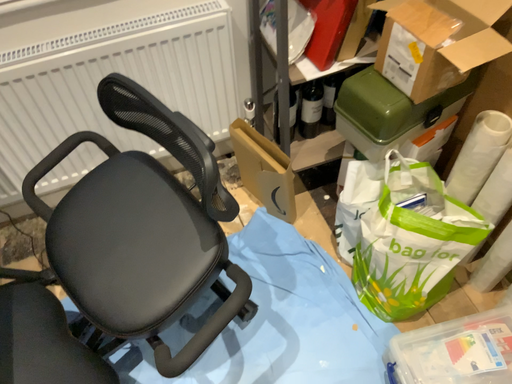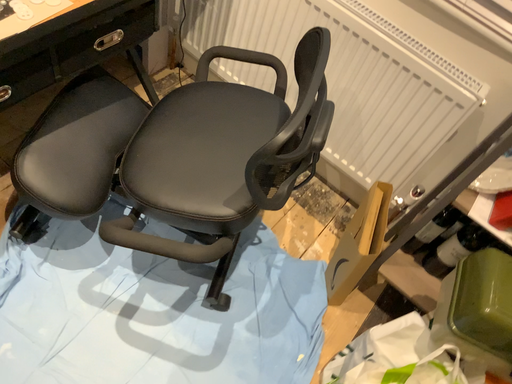
Question: Which way did the camera rotate in the video?

Choices:
 (A) rotated right
 (B) rotated left

Answer: (B)